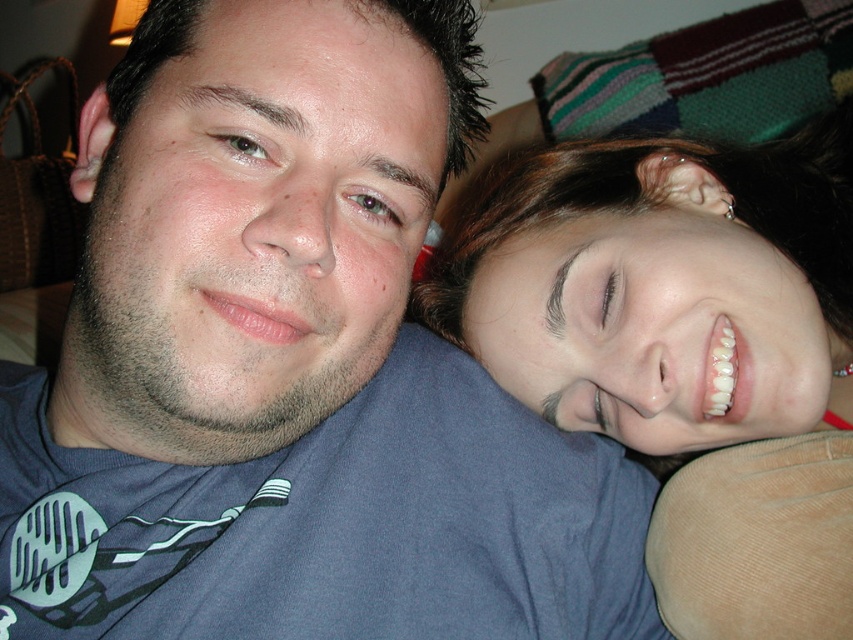
Between smooth skin face at upper right and brown matte eye at upper left, which one has more height?

smooth skin face at upper right is taller.

Is point (733, 397) positioned before point (228, 140)?

No, (733, 397) is further to viewer.

Where is `smooth skin face at upper right`? smooth skin face at upper right is located at coordinates (685, 349).

Between point (671, 228) and point (398, 220), which one is positioned in front?

Point (398, 220) is more forward.

Does smooth skin face at upper right have a larger size compared to brown matte eye at center?

Yes.

Find the location of `smooth skin face at upper right`. smooth skin face at upper right is located at coordinates (685, 349).

Find the location of a particular element. This screenshot has width=853, height=640. smooth skin face at upper right is located at coordinates (685, 349).

Describe the element at coordinates (242, 147) in the screenshot. This screenshot has height=640, width=853. I see `brown matte eye at upper left` at that location.

Between point (235, 138) and point (375, 193), which one is positioned in front?

Positioned in front is point (235, 138).

This screenshot has height=640, width=853. What are the coordinates of `brown matte eye at upper left` in the screenshot? It's located at (242, 147).